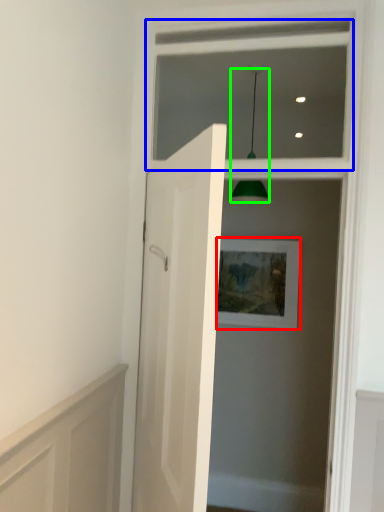
Question: Which object is the farthest from picture frame (highlighted by a red box)? Choose among these: window frame (highlighted by a blue box) or light fixture (highlighted by a green box).

Choices:
 (A) window frame
 (B) light fixture

Answer: (A)